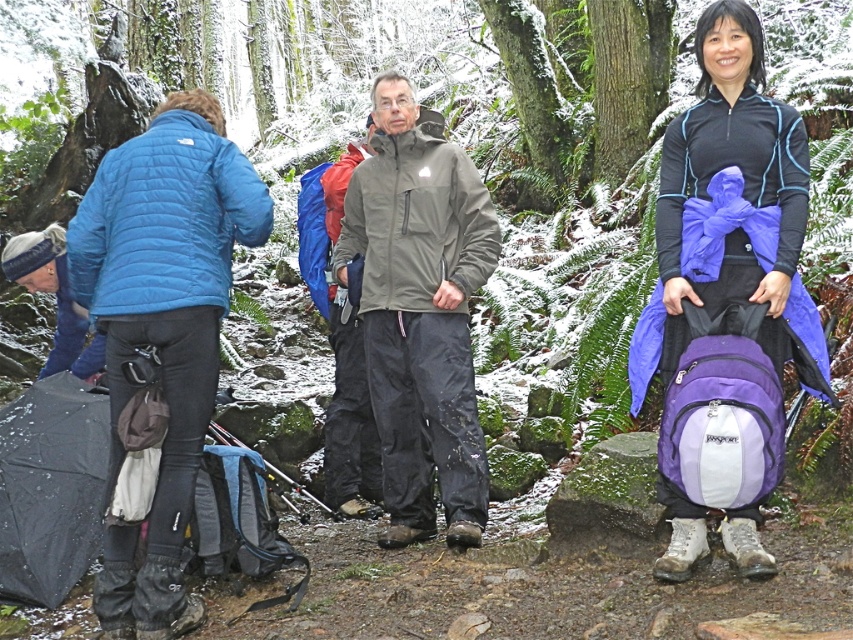
Between point (125, 268) and point (395, 420), which one is positioned behind?

Positioned behind is point (395, 420).

Is matte blue jacket at left positioned in front of gray softshell jacket at center?

That is True.

From the picture: Measure the distance between point (90,227) and camera.

Point (90,227) and camera are 5.12 meters apart.

Find the location of a particular element. The image size is (853, 640). matte blue jacket at left is located at coordinates tap(163, 326).

Is matte purple backpack at center closer to camera compared to gray softshell jacket at center?

Yes, it is.

Which is below, matte purple backpack at center or gray softshell jacket at center?

Positioned lower is gray softshell jacket at center.

Which is in front, point (788, 147) or point (378, 401)?

Point (788, 147) is in front.

I want to click on matte purple backpack at center, so click(x=727, y=298).

Is matte purple backpack at center to the right of matte blue jacket at left from the viewer's perspective?

Yes, matte purple backpack at center is to the right of matte blue jacket at left.

Between point (650, 307) and point (115, 332), which one is positioned behind?

The point (650, 307) is behind.

Where is `matte purple backpack at center`? The height and width of the screenshot is (640, 853). matte purple backpack at center is located at coordinates (727, 298).

The height and width of the screenshot is (640, 853). In order to click on matte purple backpack at center in this screenshot , I will do `click(727, 298)`.